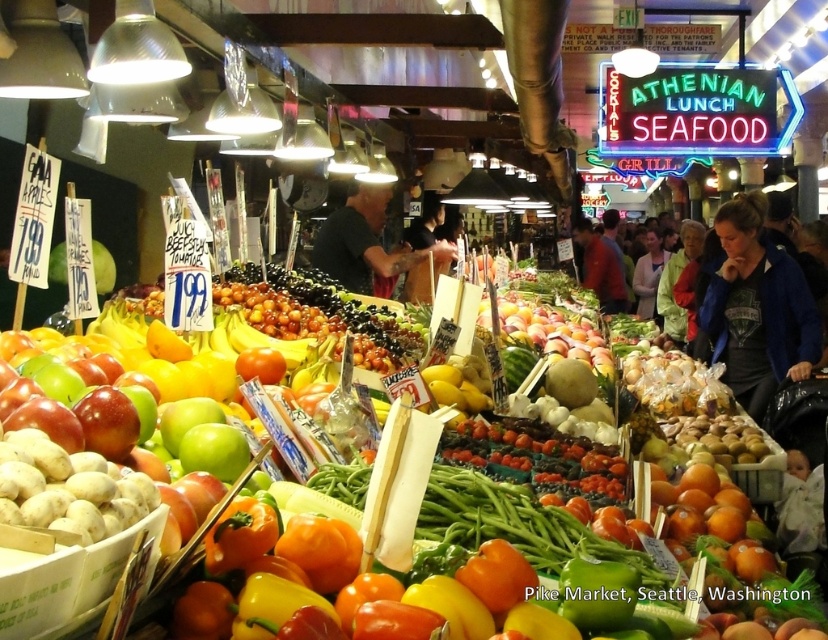
You are a vendor at Pike Market and need to locate a customer who is wearing either the blue fabric jacket at right or the black shirt at center. If you are standing at the front of the market, which customer will you see first?

The blue fabric jacket at right is in front of the black shirt at center, so you will see the blue fabric jacket at right first.

You are a customer at Pike Market and want to buy some grapes. You see two people wearing a black shirt at center and a red shirt at center. Which person is positioned to the left of the other?

The black shirt at center is to the left of the red shirt at center.

Looking at this image, you are standing at the entrance of Pike Market and want to take a photo of two points in the scene. The first point is at coordinates point (740,356) and the second point is at point (579,236). Which point will appear larger in your photo?

Point (740,356) is closer to the camera than point (579,236), so it will appear larger in the photo.